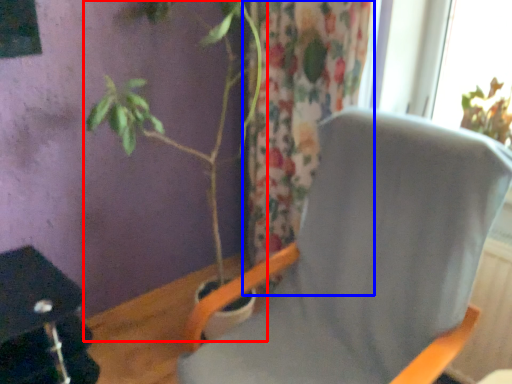
Question: Which of the following is the closest to the observer, houseplant (highlighted by a red box) or curtain (highlighted by a blue box)?

Choices:
 (A) houseplant
 (B) curtain

Answer: (A)